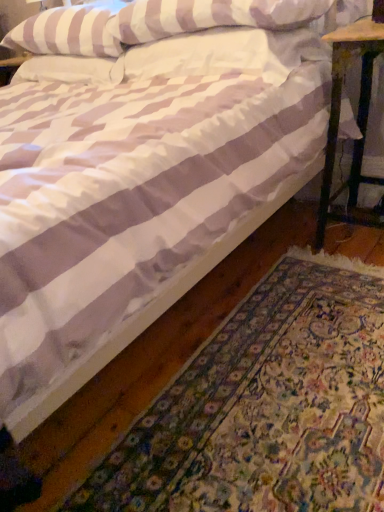
Question: Does wooden stool at right contain white striped pillow at upper center, placed as the 2th pillow when sorted from right to left?

Choices:
 (A) no
 (B) yes

Answer: (A)

Question: Can you confirm if wooden stool at right is smaller than white striped pillow at upper center, placed as the 2th pillow when sorted from right to left?

Choices:
 (A) no
 (B) yes

Answer: (A)

Question: From the image's perspective, is wooden stool at right located above white striped pillow at upper center, placed as the 2th pillow when sorted from right to left?

Choices:
 (A) no
 (B) yes

Answer: (A)

Question: Does wooden stool at right have a greater height compared to white striped pillow at upper center, arranged as the 2th pillow when viewed from the left?

Choices:
 (A) no
 (B) yes

Answer: (B)

Question: Does wooden stool at right come in front of white striped pillow at upper center, arranged as the 2th pillow when viewed from the left?

Choices:
 (A) yes
 (B) no

Answer: (B)

Question: Relative to white striped pillow at upper center, placed as the 2th pillow when sorted from right to left, is wooden stool at right in front or behind?

Choices:
 (A) behind
 (B) front

Answer: (A)

Question: Looking at their shapes, would you say wooden stool at right is wider or thinner than white striped pillow at upper center, arranged as the 2th pillow when viewed from the left?

Choices:
 (A) wide
 (B) thin

Answer: (B)

Question: From a real-world perspective, is wooden stool at right physically located above or below white striped pillow at upper center, arranged as the 2th pillow when viewed from the left?

Choices:
 (A) below
 (B) above

Answer: (A)

Question: From the image's perspective, is wooden stool at right above or below white striped pillow at upper center, placed as the 2th pillow when sorted from right to left?

Choices:
 (A) above
 (B) below

Answer: (B)

Question: From the image's perspective, is white striped pillow at upper center, which is the first pillow from right to left, located above or below wooden stool at right?

Choices:
 (A) above
 (B) below

Answer: (A)

Question: Would you say white striped pillow at upper center, which is the first pillow from right to left, is to the left or to the right of wooden stool at right in the picture?

Choices:
 (A) right
 (B) left

Answer: (B)

Question: Relative to wooden stool at right, is white striped pillow at upper center, placed as the 3th pillow when sorted from left to right, in front or behind?

Choices:
 (A) behind
 (B) front

Answer: (B)

Question: From a real-world perspective, relative to wooden stool at right, is white striped pillow at upper center, which is the first pillow from right to left, vertically above or below?

Choices:
 (A) above
 (B) below

Answer: (A)

Question: Is white textured rug at lower right wider or thinner than wooden stool at right?

Choices:
 (A) wide
 (B) thin

Answer: (A)

Question: From a real-world perspective, relative to wooden stool at right, is white textured rug at lower right vertically above or below?

Choices:
 (A) above
 (B) below

Answer: (B)